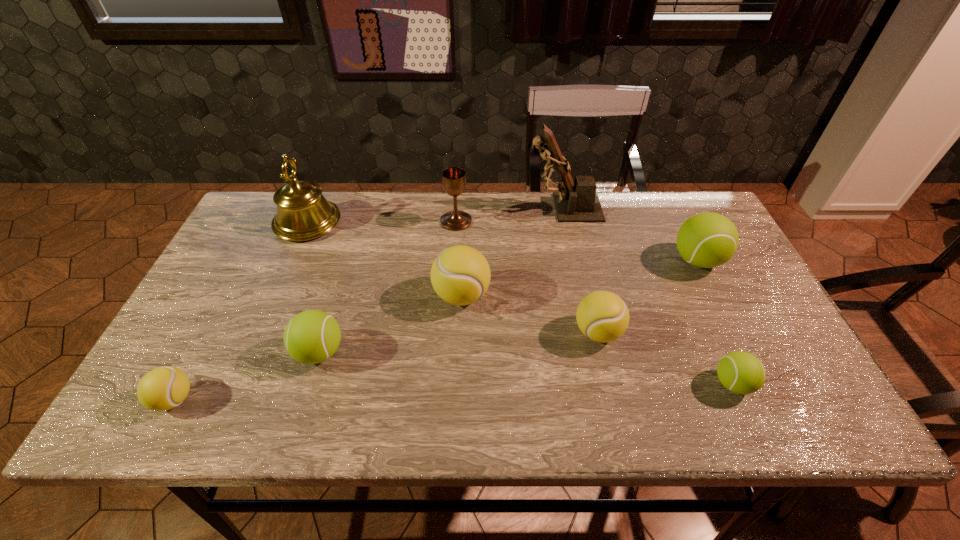
Locate an element on the screen. The height and width of the screenshot is (540, 960). figurine is located at coordinates (578, 202).

The image size is (960, 540). I want to click on brown figurine, so click(578, 202).

The image size is (960, 540). Find the location of `the eighth shortest object`. the eighth shortest object is located at coordinates (303, 213).

You are a GUI agent. You are given a task and a screenshot of the screen. Output one action in this format:
    pyautogui.click(x=<x>, y=<y>)
    Task: Click on the gold bell
    Image resolution: width=960 pixels, height=540 pixels.
    Given the screenshot: What is the action you would take?
    pyautogui.click(x=303, y=213)

The height and width of the screenshot is (540, 960). I want to click on chalice, so click(x=454, y=181).

Identify the location of the biggest yellow tennis ball. (460, 275).

You are a GUI agent. You are given a task and a screenshot of the screen. Output one action in this format:
    pyautogui.click(x=<x>, y=<y>)
    Task: Click on the second yellow tennis ball from right to left
    This screenshot has height=540, width=960.
    Given the screenshot: What is the action you would take?
    pyautogui.click(x=460, y=275)

Locate an element on the screen. the biggest green tennis ball is located at coordinates (706, 240).

I want to click on the second smallest green tennis ball, so click(x=313, y=336).

You are a GUI agent. You are given a task and a screenshot of the screen. Output one action in this format:
    pyautogui.click(x=<x>, y=<y>)
    Task: Click on the leftmost green tennis ball
    
    Given the screenshot: What is the action you would take?
    pyautogui.click(x=313, y=336)